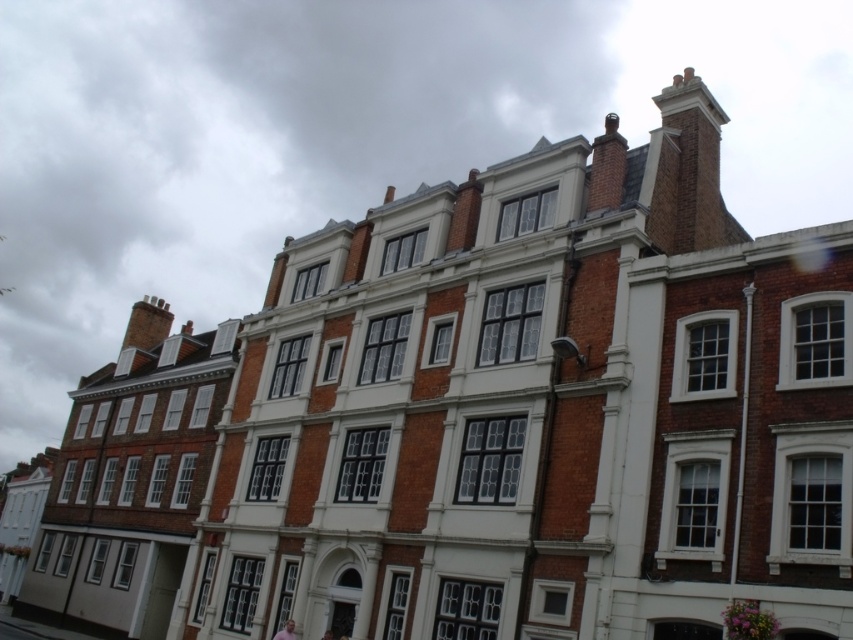
Is pink fabric at center to the left of pink fabric at lower center from the viewer's perspective?

Indeed, pink fabric at center is positioned on the left side of pink fabric at lower center.

Is pink fabric at center smaller than pink fabric at lower center?

Incorrect, pink fabric at center is not smaller in size than pink fabric at lower center.

At what (x,y) coordinates should I click in order to perform the action: click on pink fabric at center. Please return your answer as a coordinate pair (x, y). The width and height of the screenshot is (853, 640). Looking at the image, I should click on (286, 632).